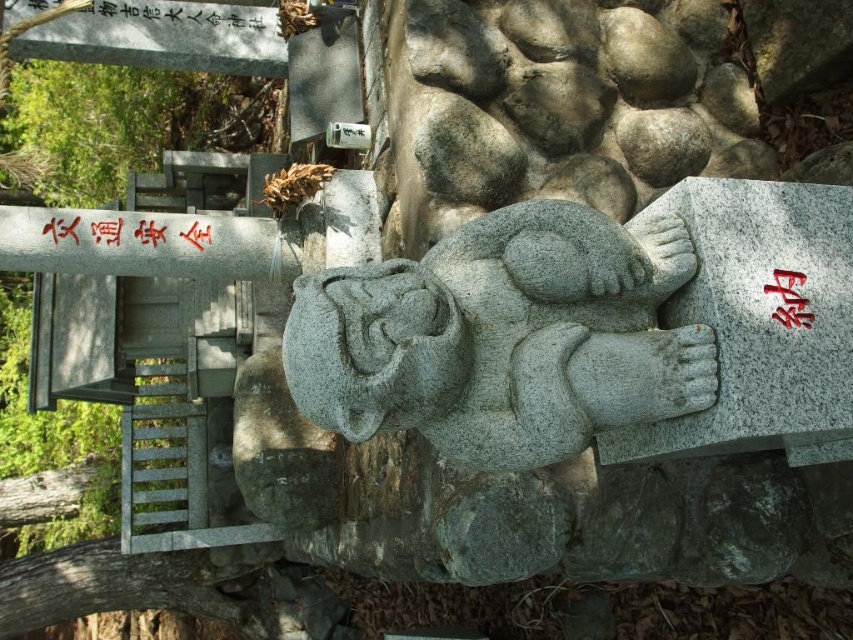
You are an archaeologist examining the statue and its surroundings. You notice the red painted stone at center right and the black stone writing at upper center. Which of these two objects has a smaller width?

The red painted stone at center right has a lesser width compared to the black stone writing at upper center.

You are an archaeologist examining the ancient site. You notice the gray stone statue at center and the red painted stone at center right. Which object is wider?

The gray stone statue at center is wider than the red painted stone at center right.